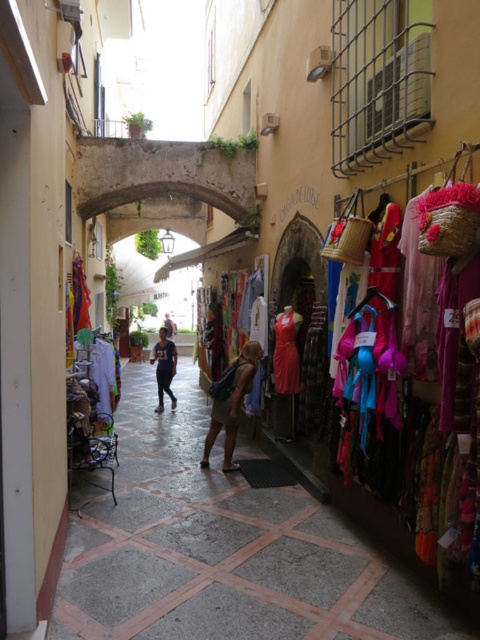
Question: Where is blue fabric dress at center located in relation to beige fabric skirt at center in the image?

Choices:
 (A) below
 (B) above

Answer: (A)

Question: Can you confirm if beige fabric skirt at center is positioned to the right of dark blue fabric at center?

Choices:
 (A) yes
 (B) no

Answer: (A)

Question: Among these objects, which one is nearest to the camera?

Choices:
 (A) blue fabric dress at center
 (B) beige fabric skirt at center
 (C) dark blue fabric at center

Answer: (A)

Question: Which point is closer to the camera taking this photo?

Choices:
 (A) (250, 387)
 (B) (184, 480)

Answer: (B)

Question: Which of the following is the farthest from the observer?

Choices:
 (A) (251, 362)
 (B) (170, 403)
 (C) (226, 627)

Answer: (B)

Question: Does blue fabric dress at center have a smaller size compared to dark blue fabric at center?

Choices:
 (A) no
 (B) yes

Answer: (B)